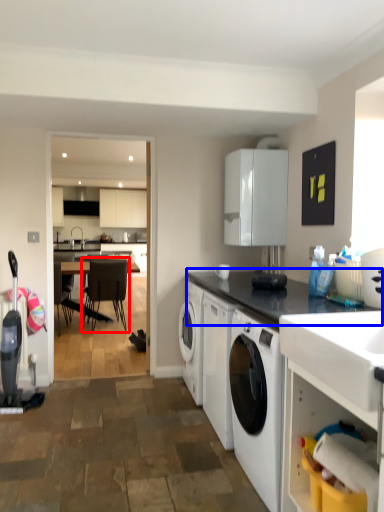
Question: Which of the following is the closest to the observer, chair (highlighted by a red box) or countertop (highlighted by a blue box)?

Choices:
 (A) chair
 (B) countertop

Answer: (B)